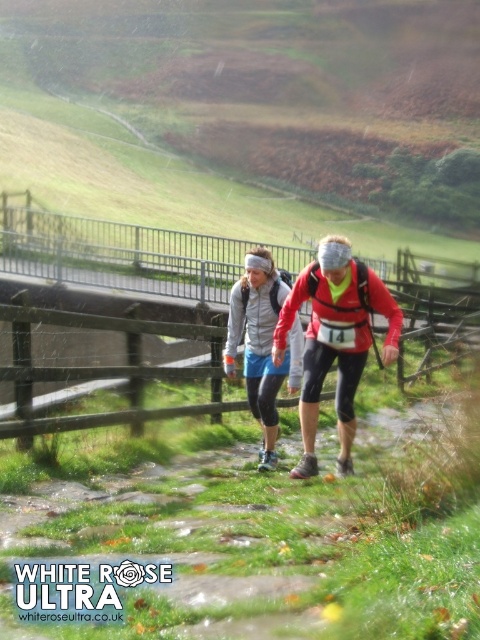
You are a participant in the White Rose Ultra trail run. You notice a wooden object at point (116, 253). What is the location of this wooden object relative to the trail?

The wooden object at point 0.392, 0.242 is located at the center of the trail.

You are a photographer positioned at the starting line of the White Rose Ultra trail race. You want to capture a photo of the matte gray jacket at center without the wooden at center blocking it. What should you do?

Move to the side so that the wooden at center is no longer between you and the matte gray jacket at center.

You are a participant in the White Rose Ultra trail run. You notice two runners wearing jackets with distinct colors. One is wearing a matte red jacket at center and the other a matte gray jacket at center. From your perspective, which runner is positioned to the right of the other?

The matte red jacket at center is to the right of the matte gray jacket at center, so the runner wearing the matte red jacket at center is positioned to the right of the runner wearing the matte gray jacket at center.